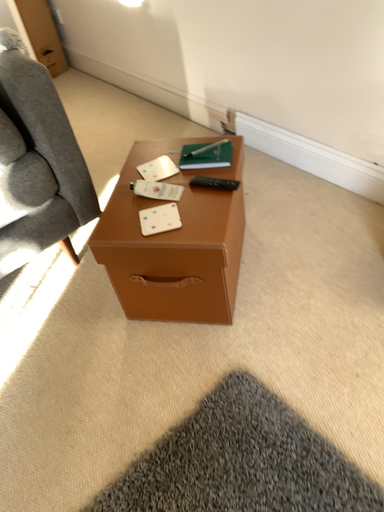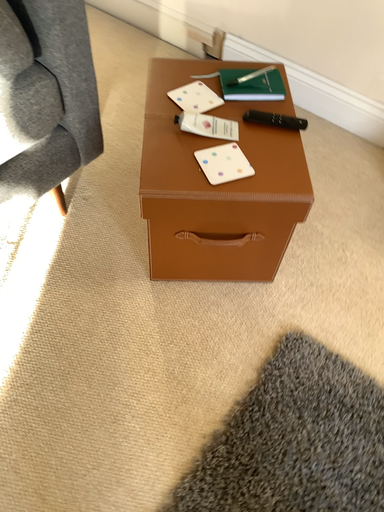
Question: Which way did the camera rotate in the video?

Choices:
 (A) rotated left
 (B) rotated right

Answer: (B)